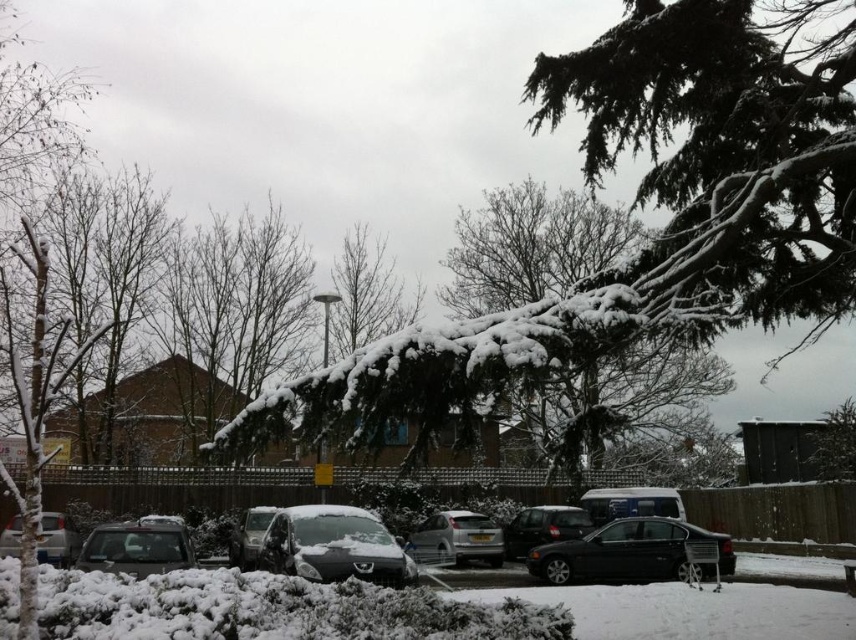
You are a delivery person trying to park your vehicle in a tight space between two cars. You have a choice between the satin silver car at center and the white glossy van at center. Which vehicle would you choose to park in the space if you need the one that takes up less room?

The white glossy van at center is smaller in size than the satin silver car at center, so you should choose the white glossy van at center to park in the tight space since it occupies less space.

You are a delivery person trying to park your vehicle in a tight space between the two cars. The space between them is exactly 1.5 meters. Your delivery van is 1.8 meters wide. Can you fit your van between the sleek metallic car at center and the sleek silver sedan at lower left?

The sleek metallic car at center is shorter than the sleek silver sedan at lower left, but the space between them is 1.5 meters. Since your van is 1.8 meters wide, it cannot fit through the 1.5 meter space between the two cars.